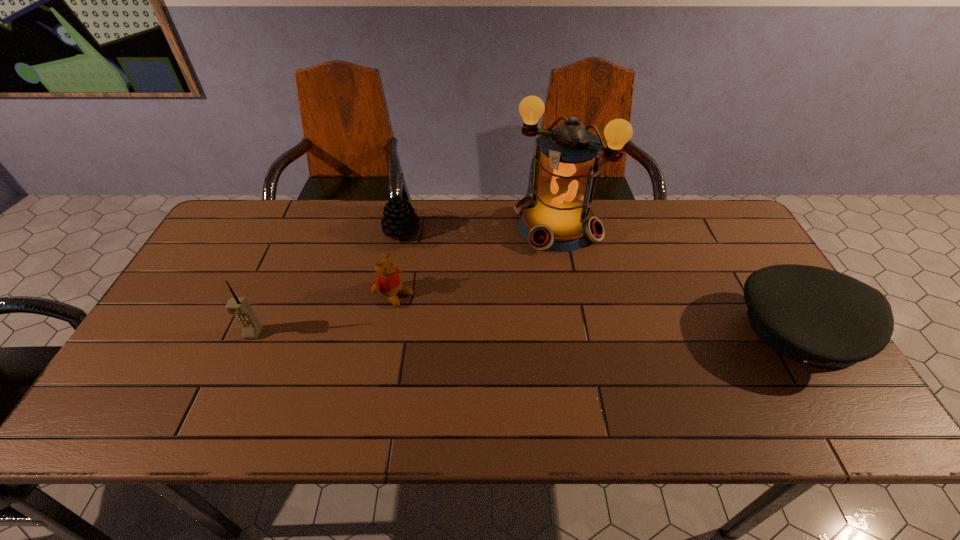
Identify the location of vacant space located on the front-facing side of the teddy bear. The width and height of the screenshot is (960, 540). tap(522, 376).

Locate an element on the screen. The height and width of the screenshot is (540, 960). free space located 0.280m on the front-facing side of the tallest object is located at coordinates (487, 310).

This screenshot has height=540, width=960. In order to click on vacant area situated on the front-facing side of the tallest object in this screenshot , I will do tap(489, 308).

Find the location of `free point located 0.260m on the front-facing side of the tallest object`. free point located 0.260m on the front-facing side of the tallest object is located at coordinates (491, 305).

Where is `vacant space located at the narrow end of the pinecone`? vacant space located at the narrow end of the pinecone is located at coordinates (436, 300).

The image size is (960, 540). Identify the location of vacant space located 0.300m at the narrow end of the pinecone. (441, 310).

I want to click on blank space located at the narrow end of the pinecone, so click(x=428, y=286).

This screenshot has height=540, width=960. What are the coordinates of `lantern present at the far edge` in the screenshot? It's located at (557, 217).

The height and width of the screenshot is (540, 960). I want to click on pinecone that is at the far edge, so click(399, 219).

Where is `object that is at the near edge`? The height and width of the screenshot is (540, 960). object that is at the near edge is located at coordinates (816, 316).